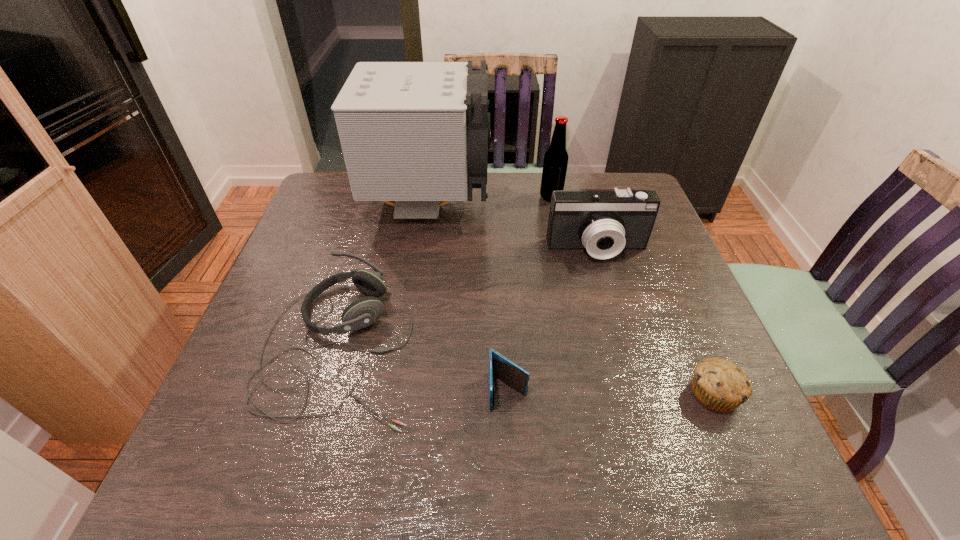
The image size is (960, 540). In order to click on free spot at the far left corner of the desktop in this screenshot , I will do pyautogui.click(x=346, y=216).

Identify the location of free location at the near left corner of the desktop. (262, 455).

Find the location of a particular element. The width and height of the screenshot is (960, 540). unoccupied area between the tallest object and the wallet is located at coordinates (468, 298).

The height and width of the screenshot is (540, 960). I want to click on empty location between the fourth tallest object and the fourth shortest object, so click(469, 297).

The width and height of the screenshot is (960, 540). I want to click on unoccupied position between the beer bottle and the wallet, so click(x=530, y=294).

Where is `vacant space that is in between the muffin and the fifth shortest object`? The image size is (960, 540). vacant space that is in between the muffin and the fifth shortest object is located at coordinates (633, 295).

Find the location of a particular element. vacant space that's between the tallest object and the headset is located at coordinates (385, 274).

Identify the location of free space between the second tallest object and the fan. (491, 201).

Where is `vacant area that lies between the wallet and the fourth shortest object`? The image size is (960, 540). vacant area that lies between the wallet and the fourth shortest object is located at coordinates (553, 320).

Identify the location of vacant point located between the fan and the muffin. The height and width of the screenshot is (540, 960). (571, 299).